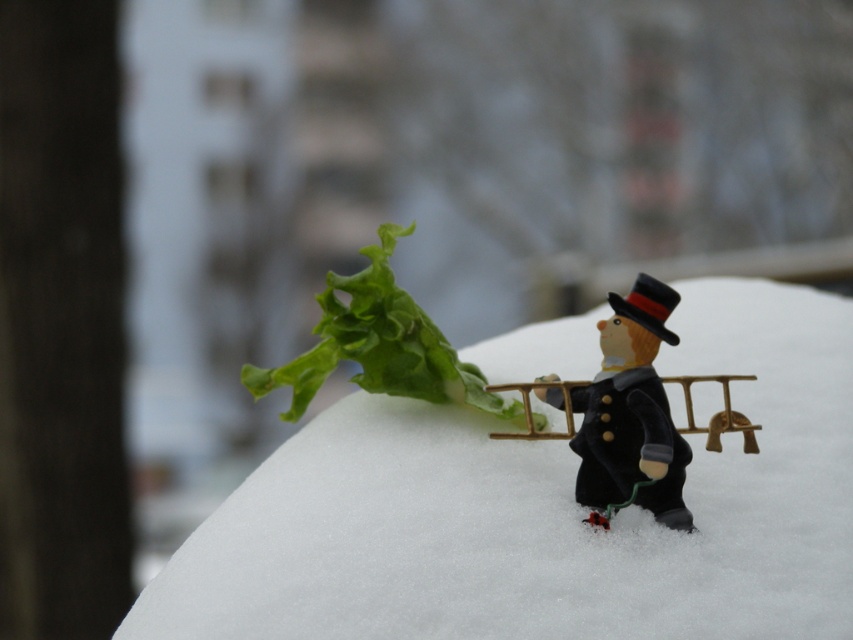
Question: Is white fluffy snow at center below velvet black toy at center?

Choices:
 (A) yes
 (B) no

Answer: (B)

Question: Which of the following is the closest to the observer?

Choices:
 (A) velvet black toy at center
 (B) white fluffy snow at center

Answer: (B)

Question: Which object is closer to the camera taking this photo?

Choices:
 (A) velvet black toy at center
 (B) white fluffy snow at center

Answer: (B)

Question: Does white fluffy snow at center have a smaller size compared to velvet black toy at center?

Choices:
 (A) no
 (B) yes

Answer: (A)

Question: Is white fluffy snow at center to the right of velvet black toy at center from the viewer's perspective?

Choices:
 (A) yes
 (B) no

Answer: (A)